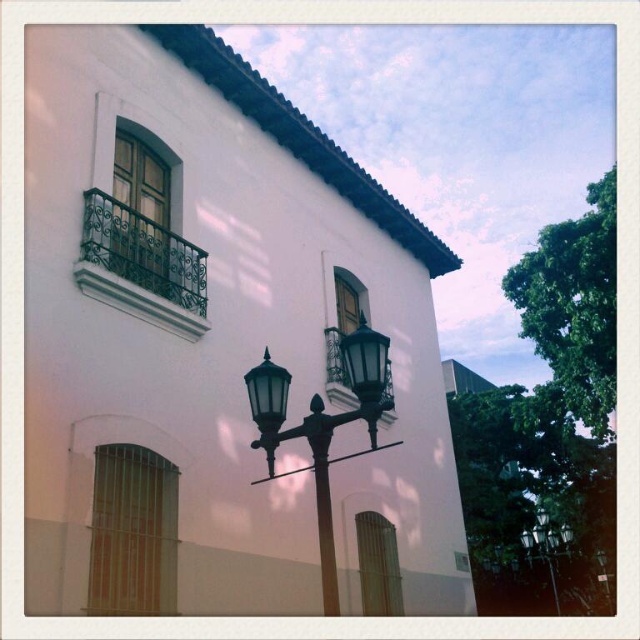
Question: Can you confirm if bronze textured street light at center is smaller than black glass street light at center?

Choices:
 (A) yes
 (B) no

Answer: (A)

Question: Which point is closer to the camera?

Choices:
 (A) pos(541,522)
 (B) pos(324,548)

Answer: (B)

Question: Which point is farther from the camera taking this photo?

Choices:
 (A) (324, 570)
 (B) (554, 584)

Answer: (B)

Question: Considering the relative positions of bronze textured street light at center and black glass street light at center in the image provided, where is bronze textured street light at center located with respect to black glass street light at center?

Choices:
 (A) above
 (B) below

Answer: (A)

Question: Does bronze textured street light at center have a smaller size compared to black glass street light at center?

Choices:
 (A) yes
 (B) no

Answer: (A)